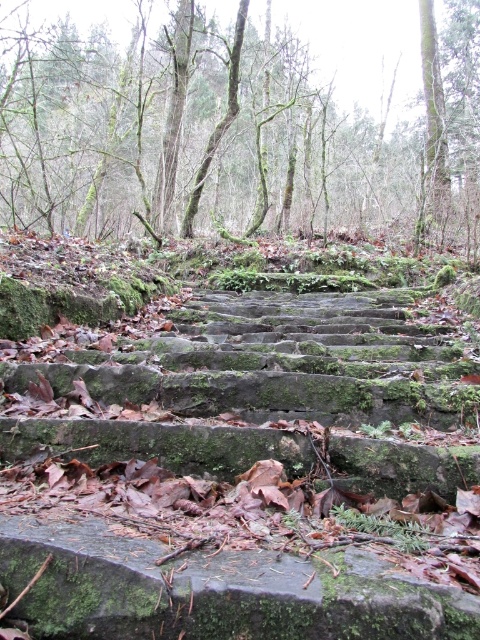
Is the position of mossy stone stairs at center more distant than that of green mossy stone steps at center?

No, mossy stone stairs at center is closer to the viewer.

Who is higher up, mossy stone stairs at center or green mossy stone steps at center?

green mossy stone steps at center

Where is `mossy stone stairs at center`? The image size is (480, 640). mossy stone stairs at center is located at coordinates (245, 477).